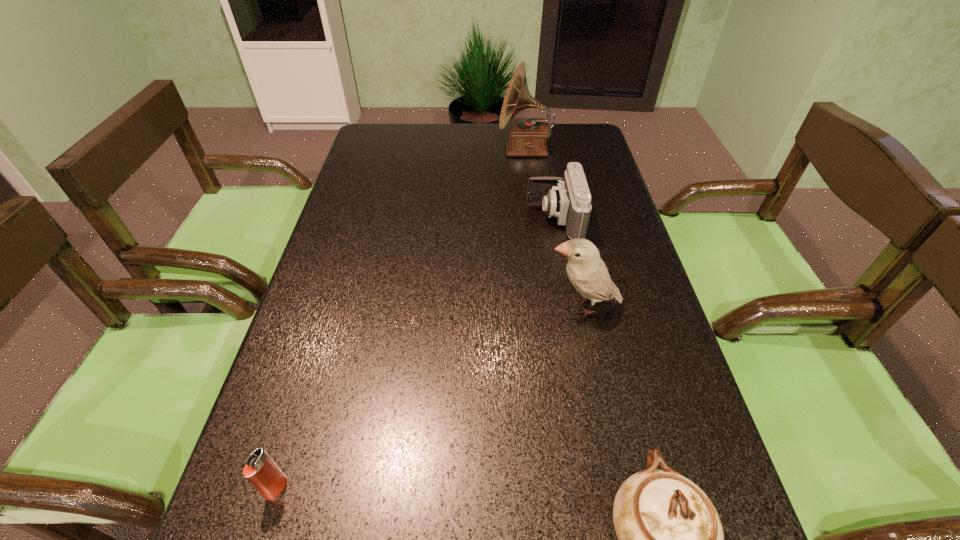
At what (x,y) coordinates should I click in order to perform the action: click on vacant space located 0.390m at the face of the second tallest object. Please return your answer as a coordinate pair (x, y). Looking at the image, I should click on (370, 306).

The height and width of the screenshot is (540, 960). Find the location of `vacant space located 0.180m at the face of the second tallest object`. vacant space located 0.180m at the face of the second tallest object is located at coordinates (465, 306).

Identify the location of free space located at the front of the second farthest object with an open lens cover. (401, 219).

Find the location of a particular element. This screenshot has width=960, height=540. free space located 0.210m at the front of the second farthest object with an open lens cover is located at coordinates [449, 219].

At what (x,y) coordinates should I click in order to perform the action: click on free space located at the front of the second farthest object with an open lens cover. Please return your answer as a coordinate pair (x, y). Looking at the image, I should click on (431, 219).

Find the location of a particular element. The height and width of the screenshot is (540, 960). free space located on the right of the leftmost object is located at coordinates (465, 488).

You are a GUI agent. You are given a task and a screenshot of the screen. Output one action in this format:
    pyautogui.click(x=<x>, y=<y>)
    Task: Click on the object that is at the far edge
    The width and height of the screenshot is (960, 540).
    Given the screenshot: What is the action you would take?
    pyautogui.click(x=527, y=136)

Locate an element on the screen. The width and height of the screenshot is (960, 540). object present at the left edge is located at coordinates (261, 471).

Locate an element on the screen. This screenshot has width=960, height=540. phonograph record present at the right edge is located at coordinates (527, 136).

Identify the location of bird that is at the right edge. (587, 272).